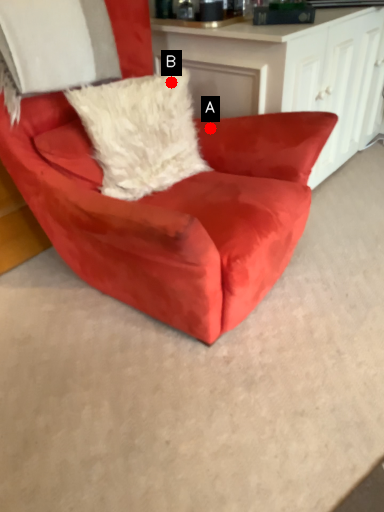
Question: Two points are circled on the image, labeled by A and B beside each circle. Which point is further to the camera?

Choices:
 (A) A is further
 (B) B is further

Answer: (A)